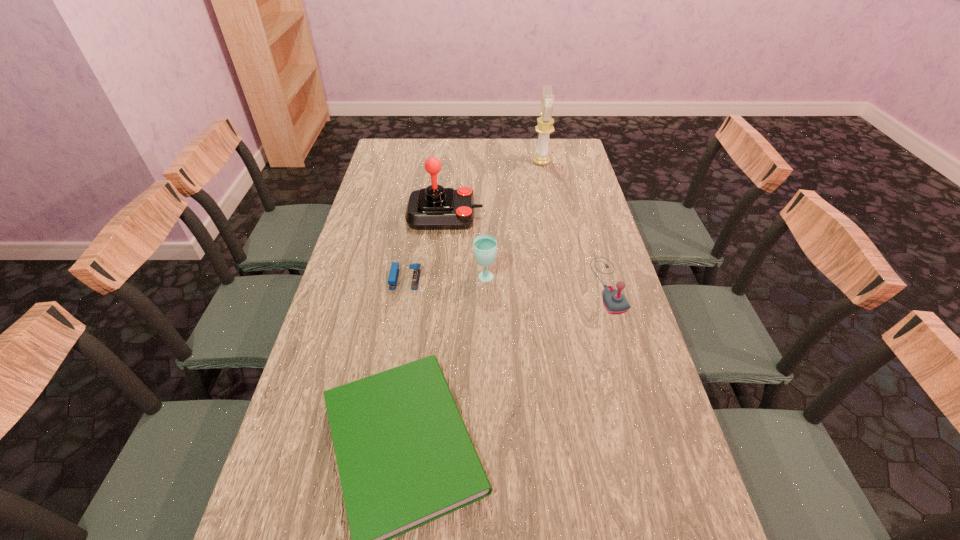
What are the coordinates of `free space that satisfies the following two spatial constraints: 1. on the front-facing side of the fifth object from left to right; 2. on the left side of the rightmost object` in the screenshot? It's located at (565, 285).